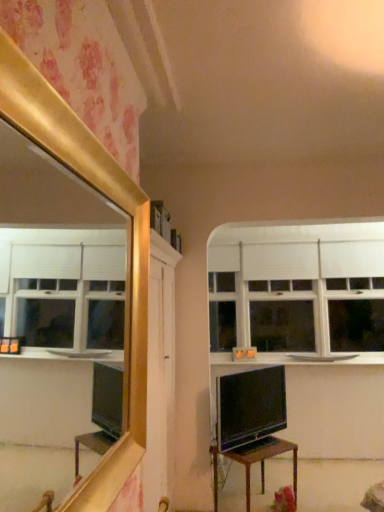
Question: From the image's perspective, is white matte window at upper center under white glossy counter top at upper right?

Choices:
 (A) yes
 (B) no

Answer: (B)

Question: Is white matte window at upper center touching white glossy counter top at upper right?

Choices:
 (A) yes
 (B) no

Answer: (B)

Question: Considering the relative positions of white matte window at upper center and white glossy counter top at upper right in the image provided, is white matte window at upper center to the right of white glossy counter top at upper right from the viewer's perspective?

Choices:
 (A) yes
 (B) no

Answer: (A)

Question: From a real-world perspective, is white matte window at upper center beneath white glossy counter top at upper right?

Choices:
 (A) yes
 (B) no

Answer: (B)

Question: Considering the relative sizes of white matte window at upper center and white glossy counter top at upper right in the image provided, is white matte window at upper center shorter than white glossy counter top at upper right?

Choices:
 (A) yes
 (B) no

Answer: (B)

Question: Can you confirm if white matte window at upper center is thinner than white glossy counter top at upper right?

Choices:
 (A) yes
 (B) no

Answer: (A)

Question: Is wooden table at center looking in the opposite direction of white glossy counter top at upper right?

Choices:
 (A) no
 (B) yes

Answer: (A)

Question: From a real-world perspective, is wooden table at center located beneath white glossy counter top at upper right?

Choices:
 (A) yes
 (B) no

Answer: (A)

Question: Considering the relative positions of wooden table at center and white glossy counter top at upper right in the image provided, is wooden table at center to the right of white glossy counter top at upper right from the viewer's perspective?

Choices:
 (A) yes
 (B) no

Answer: (B)

Question: Does wooden table at center appear on the left side of white glossy counter top at upper right?

Choices:
 (A) yes
 (B) no

Answer: (A)

Question: Is wooden table at center taller than white glossy counter top at upper right?

Choices:
 (A) no
 (B) yes

Answer: (B)

Question: From a real-world perspective, is wooden table at center on top of white glossy counter top at upper right?

Choices:
 (A) no
 (B) yes

Answer: (A)

Question: Is matte black tv at center facing towards white matte window at upper center?

Choices:
 (A) no
 (B) yes

Answer: (A)